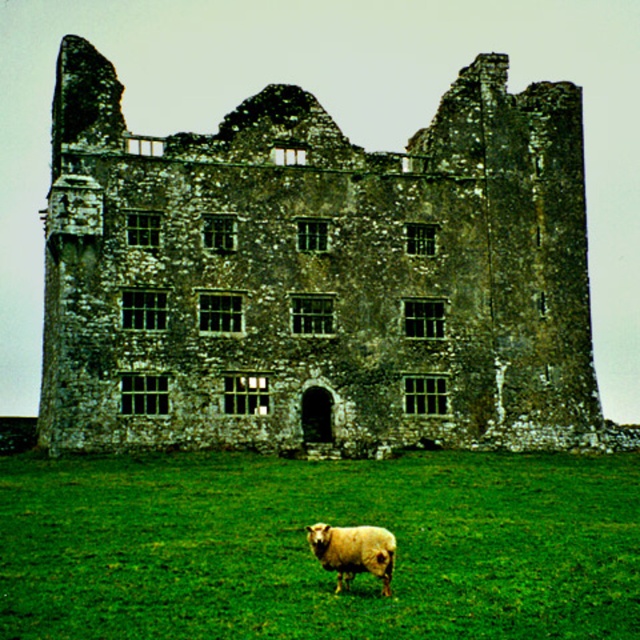
Is rusty stone castle at center wider than white woolly sheep at lower center?

Yes, rusty stone castle at center is wider than white woolly sheep at lower center.

Consider the image. Who is more distant from viewer, (272, 225) or (372, 531)?

The point (272, 225) is behind.

In order to click on rusty stone castle at center in this screenshot , I will do `click(317, 275)`.

Between point (285, 600) and point (390, 552), which one is positioned in front?

Point (285, 600)

Is point (365, 524) positioned in front of point (371, 566)?

No.

Where is `green grass at lower center`? This screenshot has height=640, width=640. green grass at lower center is located at coordinates (310, 554).

Can you confirm if rusty stone castle at center is positioned below green grass at lower center?

No, rusty stone castle at center is not below green grass at lower center.

Which is more to the right, rusty stone castle at center or green grass at lower center?

From the viewer's perspective, green grass at lower center appears more on the right side.

The height and width of the screenshot is (640, 640). What are the coordinates of `rusty stone castle at center` in the screenshot? It's located at (317, 275).

At what (x,y) coordinates should I click in order to perform the action: click on rusty stone castle at center. Please return your answer as a coordinate pair (x, y). This screenshot has width=640, height=640. Looking at the image, I should click on (317, 275).